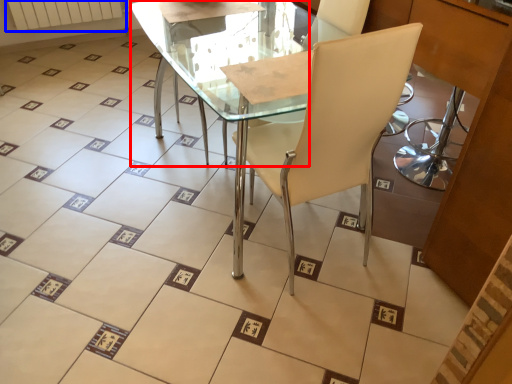
Question: Which object appears farthest to the camera in this image, round table (highlighted by a red box) or radiator (highlighted by a blue box)?

Choices:
 (A) round table
 (B) radiator

Answer: (B)